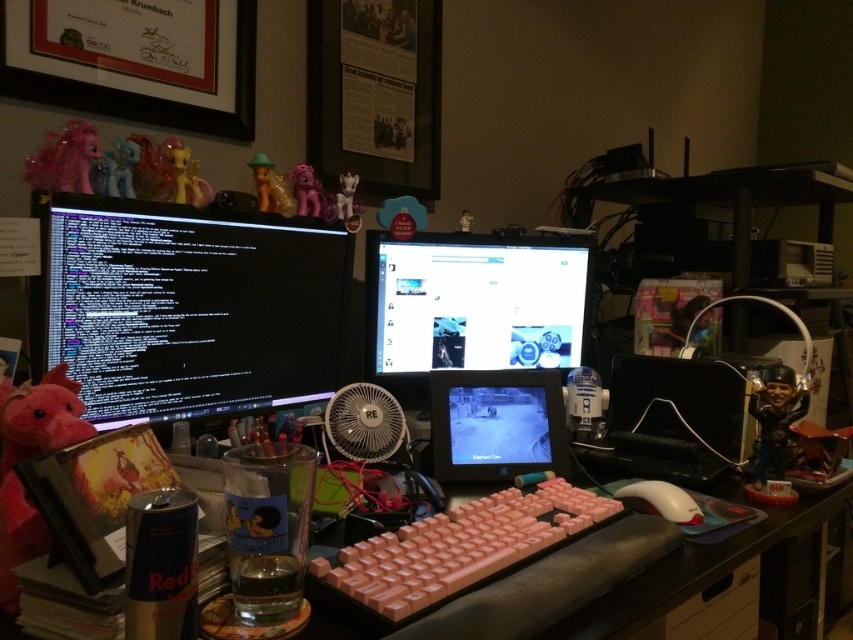
Question: Which is nearer to the pastel yellow plastic pony at upper center?

Choices:
 (A) shiny plastic figurine at right
 (B) peach matte keyboard at center
 (C) pink plastic toy at upper center
 (D) white plastic fan at center

Answer: (C)

Question: Is pink plastic monitor at center below white plastic fan at center?

Choices:
 (A) yes
 (B) no

Answer: (B)

Question: Which of the following is the closest to the observer?

Choices:
 (A) (206, 182)
 (B) (264, 184)

Answer: (A)

Question: Which object is farther from the camera taking this photo?

Choices:
 (A) pink plush toy at upper left
 (B) pink plastic keyboard at center
 (C) black glossy monitor at left

Answer: (A)

Question: Can you confirm if pink plastic tablet at center is positioned below white plastic fan at center?

Choices:
 (A) yes
 (B) no

Answer: (A)

Question: Can you confirm if pink plush toy at upper left is wider than matte plastic my little pony at upper center?

Choices:
 (A) yes
 (B) no

Answer: (A)